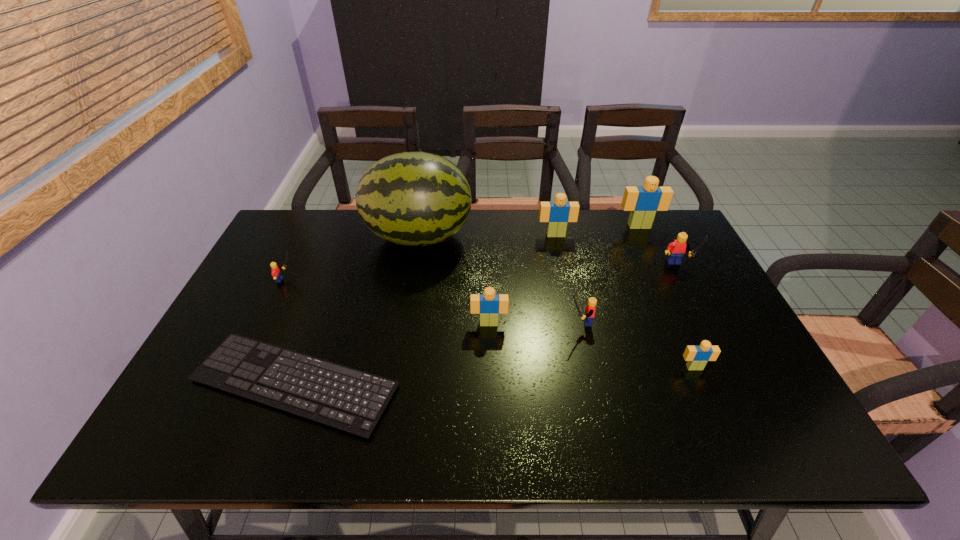
Locate an element on the screen. This screenshot has width=960, height=540. blank space that satisfies the following two spatial constraints: 1. on the front-facing side of the leftmost Lego; 2. on the back side of the black computer keyboard is located at coordinates (235, 383).